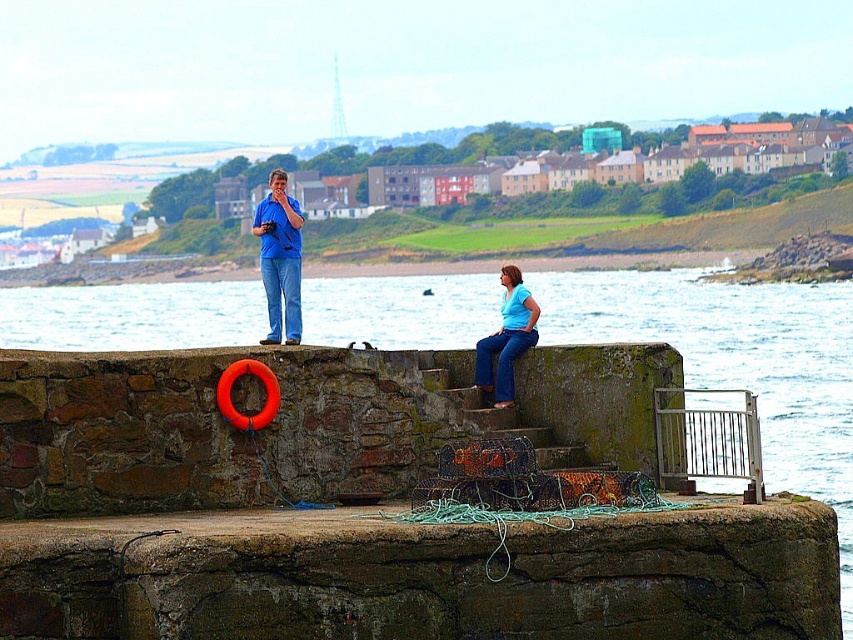
You are standing on the jetty and want to take a photo of the blue denim jeans at center without the blue water at center appearing in the frame. Which direction should you move to achieve this?

Move to the right side of the jetty, near the metal railing, to position yourself where the blue water at center is no longer in the frame with the blue denim jeans at center.

You are standing on the stone jetty and want to take a photo of the blue water at center. Where exactly should you point your camera to capture it?

You should point your camera at the coordinates point [740,364] to capture the blue water at center.

You are a photographer standing on the jetty and want to capture both the blue water at center and the blue denim jeans at center in your photo. Which object should you focus on first if you want to ensure both are in the frame?

The blue water at center is taller than the blue denim jeans at center, so you should focus on the blue water at center first to ensure it fits within the frame, then adjust to include the blue denim jeans at center.